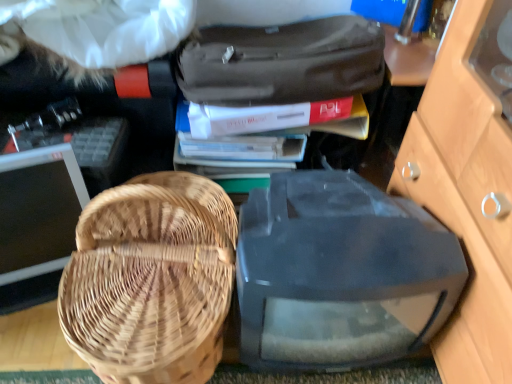
Question: Visually, is matte black monitor at left, the 1th computer monitor when ordered from left to right, positioned to the left or to the right of transparent plastic computer monitor at center, the 1th computer monitor positioned from the right?

Choices:
 (A) left
 (B) right

Answer: (A)

Question: Is matte black monitor at left, the 1th computer monitor when ordered from left to right, wider or thinner than transparent plastic computer monitor at center, the second computer monitor viewed from the left?

Choices:
 (A) wide
 (B) thin

Answer: (B)

Question: Based on their relative distances, which object is nearer to the matte black suitcase at upper center?

Choices:
 (A) matte gray book at upper center, placed as the 1th book when sorted from top to bottom
 (B) white paper book at center, which is the 1th book in bottom-to-top order
 (C) transparent plastic computer monitor at center, the 1th computer monitor positioned from the right
 (D) woven wood picnic basket at left
 (E) matte black monitor at left, the 2th computer monitor viewed from the right

Answer: (A)

Question: Considering the real-world distances, which object is closest to the matte black monitor at left, the 2th computer monitor viewed from the right?

Choices:
 (A) woven wood picnic basket at left
 (B) white paper book at center, which is the 1th book in bottom-to-top order
 (C) transparent plastic computer monitor at center, the second computer monitor viewed from the left
 (D) matte black suitcase at upper center
 (E) matte gray book at upper center, placed as the 1th book when sorted from top to bottom

Answer: (A)